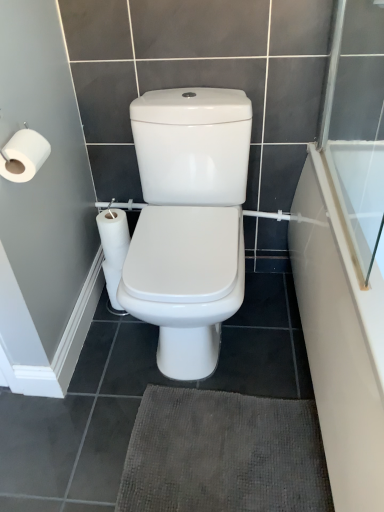
Question: Would you say transparent glass screen door at upper right is inside or outside dark gray textured bath mat at lower center?

Choices:
 (A) outside
 (B) inside

Answer: (A)

Question: In terms of height, does transparent glass screen door at upper right look taller or shorter compared to dark gray textured bath mat at lower center?

Choices:
 (A) tall
 (B) short

Answer: (A)

Question: Based on their relative distances, which object is nearer to the transparent glass screen door at upper right?

Choices:
 (A) white matte toilet paper at left
 (B) white glossy bathtub at right
 (C) dark gray textured bath mat at lower center

Answer: (B)

Question: Estimate the real-world distances between objects in this image. Which object is farther from the white matte toilet paper at left?

Choices:
 (A) transparent glass screen door at upper right
 (B) dark gray textured bath mat at lower center
 (C) white glossy bathtub at right

Answer: (A)